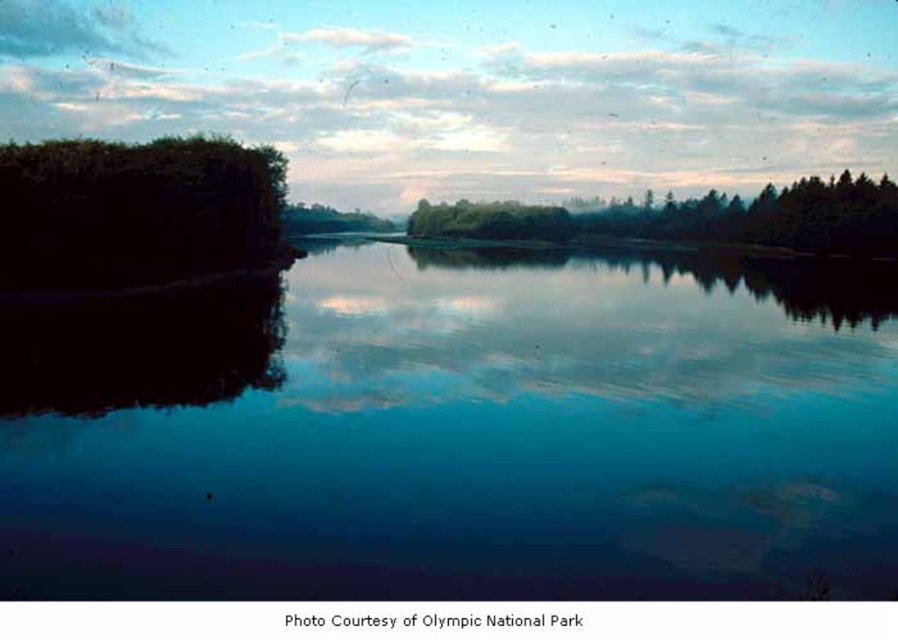
You are a boat operator who needs to navigate a 100 meter long ship through the transparent water at center. The ship requires a minimum of 150 meters of clearance between the green matte trees at center to avoid collision. Based on the scene description, can the ship safely pass through without hitting the trees?

The distance between the transparent water at center and the green matte trees at center is 261.31 meters. Since the ship requires a minimum of 150 meters of clearance, the 261.31 meters available is sufficient. Therefore, the ship can safely pass through without hitting the trees.

You are standing on the dock looking at the green leafy tree at left and the green matte trees at center. Which tree group is closer to you?

The green leafy tree at left is closer to you because it is positioned in front of the green matte trees at center.

You are a bird flying over the serene landscape. You see the point marked at coordinate (x=135, y=211). Based on the scene, can you determine what this point is located on?

The point marked at coordinate (x=135, y=211) is located on the green leafy tree at left.